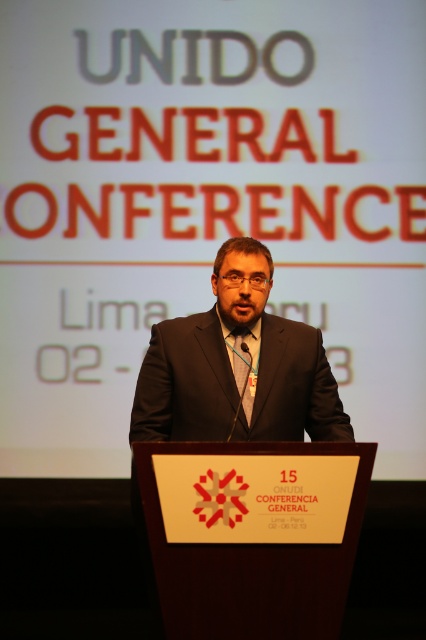
Question: Does dark gray suit at center have a lesser width compared to matte black tie at center?

Choices:
 (A) yes
 (B) no

Answer: (B)

Question: Which point is closer to the camera?

Choices:
 (A) (241, 368)
 (B) (249, 384)

Answer: (B)

Question: Which object appears closest to the camera in this image?

Choices:
 (A) matte black tie at center
 (B) dark gray suit at center

Answer: (B)

Question: Does dark gray suit at center appear on the left side of matte black tie at center?

Choices:
 (A) yes
 (B) no

Answer: (A)

Question: Is dark gray suit at center positioned at the back of matte black tie at center?

Choices:
 (A) no
 (B) yes

Answer: (A)